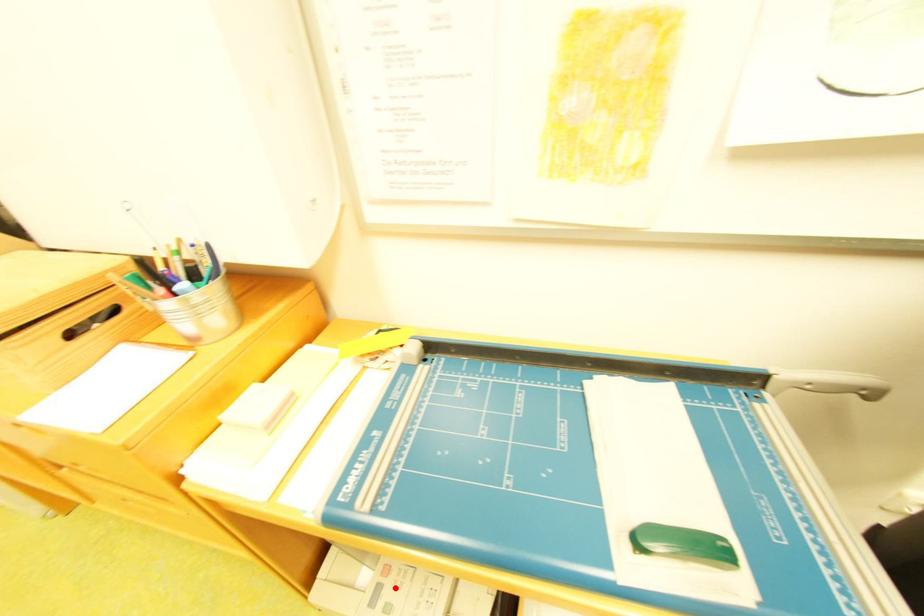
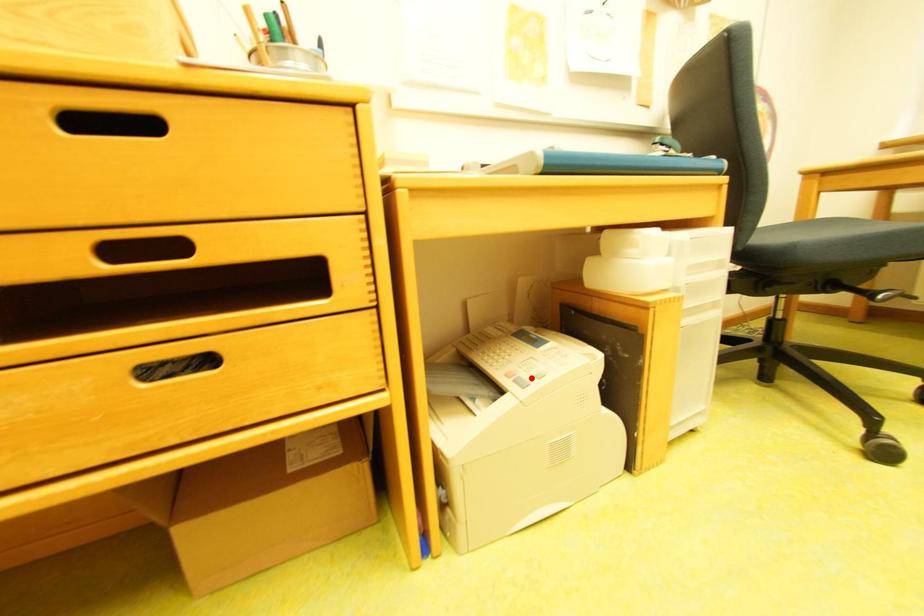
I am providing you with two images of the same scene from different viewpoints. A red point is marked on the first image and another point is marked on the second image. Are the points marked in image1 and image2 representing the same 3D position?

Yes